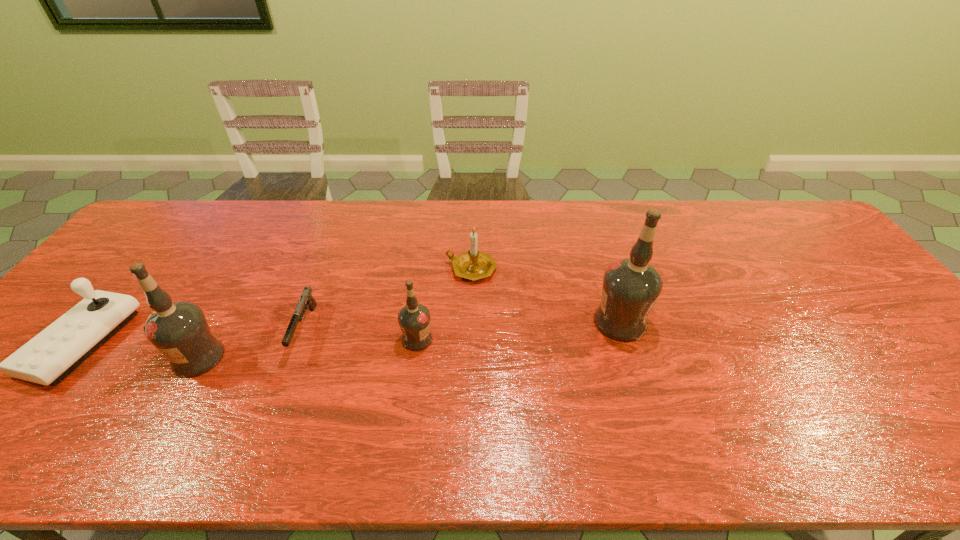
This screenshot has height=540, width=960. In order to click on the fifth shortest object in this screenshot , I will do `click(179, 330)`.

Where is `the leftmost vodka`? the leftmost vodka is located at coordinates (179, 330).

The image size is (960, 540). What are the coordinates of `the fourth shortest object` in the screenshot? It's located at (414, 318).

At what (x,y) coordinates should I click in order to perform the action: click on the shortest vodka. Please return your answer as a coordinate pair (x, y). This screenshot has height=540, width=960. Looking at the image, I should click on (414, 318).

At what (x,y) coordinates should I click in order to perform the action: click on the rightmost vodka. Please return your answer as a coordinate pair (x, y). Looking at the image, I should click on (631, 286).

At what (x,y) coordinates should I click in order to perform the action: click on the fourth object from right to left. Please return your answer as a coordinate pair (x, y). The height and width of the screenshot is (540, 960). Looking at the image, I should click on (306, 298).

Where is `the shortest object`? The width and height of the screenshot is (960, 540). the shortest object is located at coordinates (306, 298).

Locate an element on the screen. Image resolution: width=960 pixels, height=540 pixels. candle holder is located at coordinates (473, 265).

Image resolution: width=960 pixels, height=540 pixels. Identify the location of the farthest object. (473, 265).

Locate an element on the screen. Image resolution: width=960 pixels, height=540 pixels. blank space located 0.180m on the front label of the second vodka from right to left is located at coordinates (504, 339).